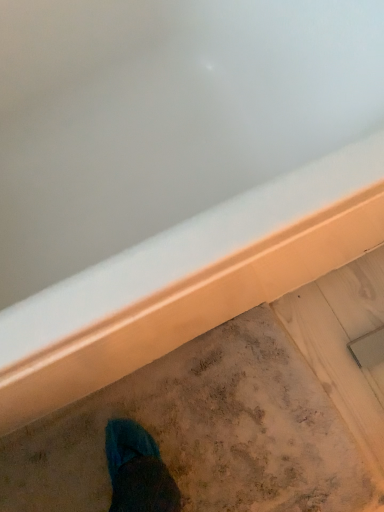
In order to face brown textured carpet at lower center, should I rotate leftwards or rightwards?

It's best to rotate right around 5.023 degrees.

Identify the location of brown textured carpet at lower center. The width and height of the screenshot is (384, 512). (202, 432).

Describe the element at coordinates (202, 432) in the screenshot. I see `brown textured carpet at lower center` at that location.

You are a GUI agent. You are given a task and a screenshot of the screen. Output one action in this format:
    pyautogui.click(x=<x>, y=<y>)
    Task: Click on the brown textured carpet at lower center
    
    Given the screenshot: What is the action you would take?
    pyautogui.click(x=202, y=432)